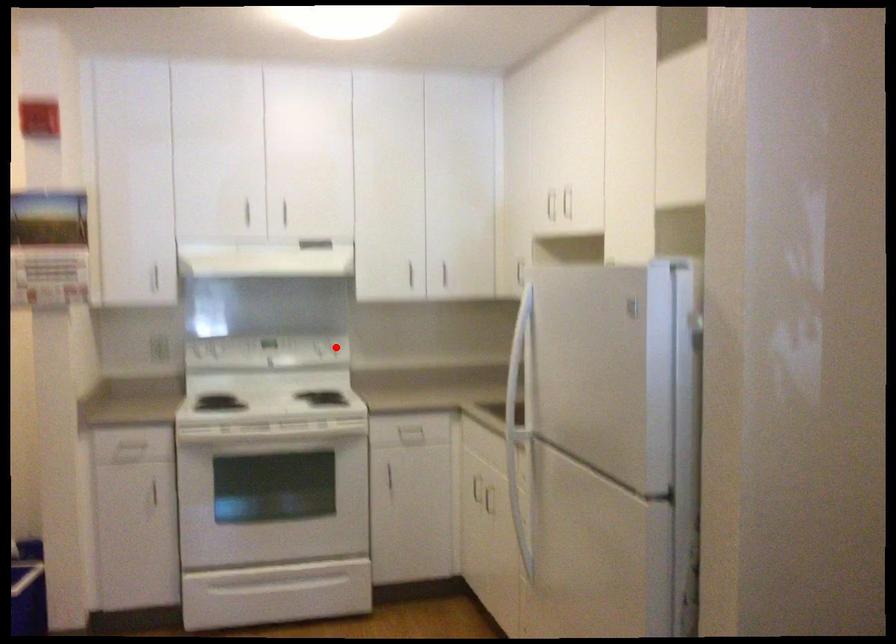
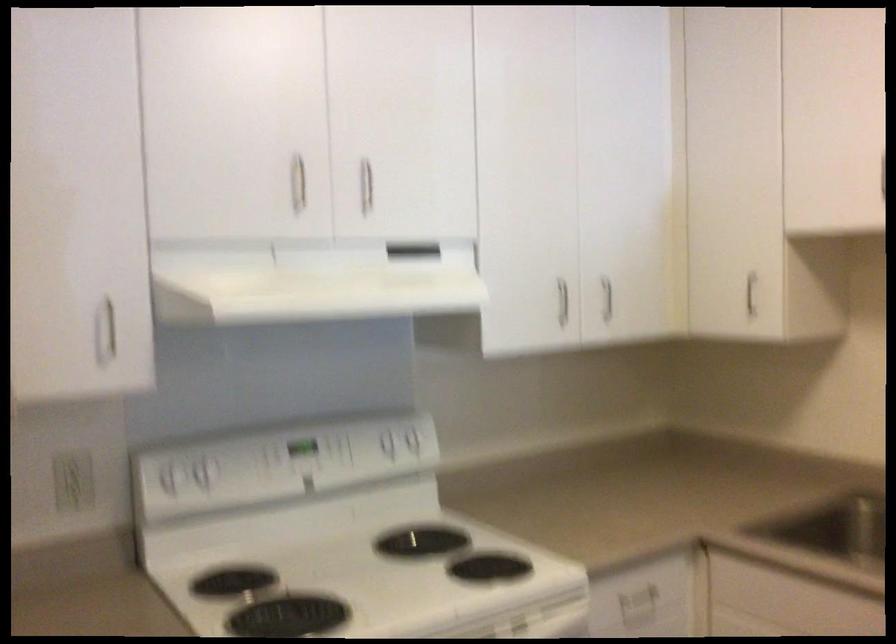
Question: I am providing you with two images of the same scene from different viewpoints. Given a red point in image1, look at the same physical point in image2. Is it:

Choices:
 (A) Closer to the viewpoint
 (B) Farther from the viewpoint

Answer: (A)